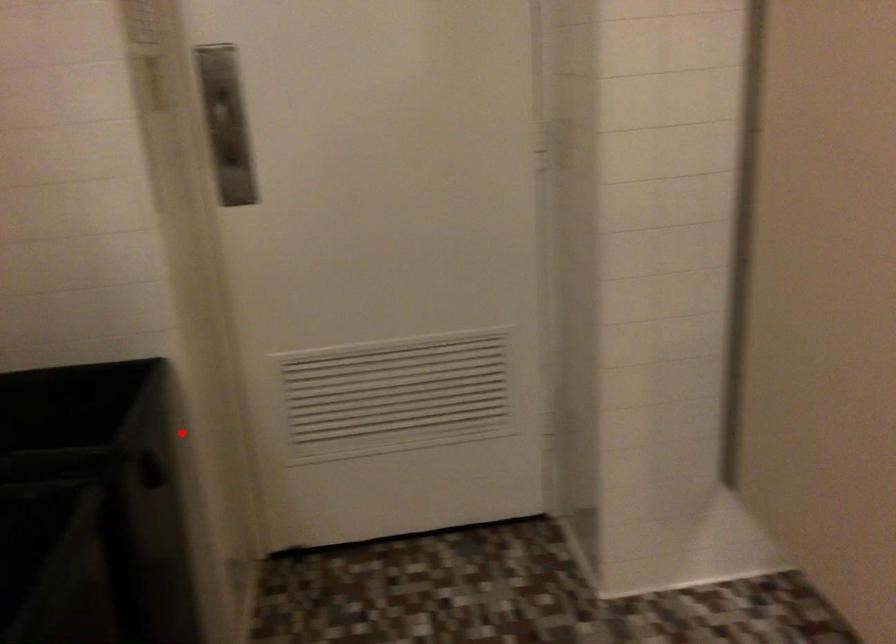
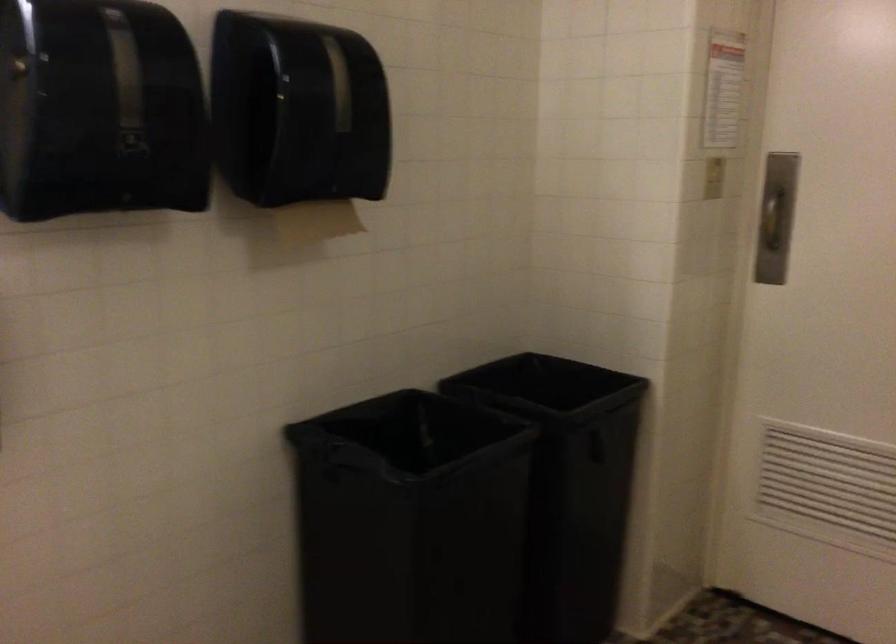
Question: I am providing you with two images of the same scene from different viewpoints. Given a red point in image1, look at the same physical point in image2. Is it:

Choices:
 (A) Closer to the viewpoint
 (B) Farther from the viewpoint

Answer: (B)